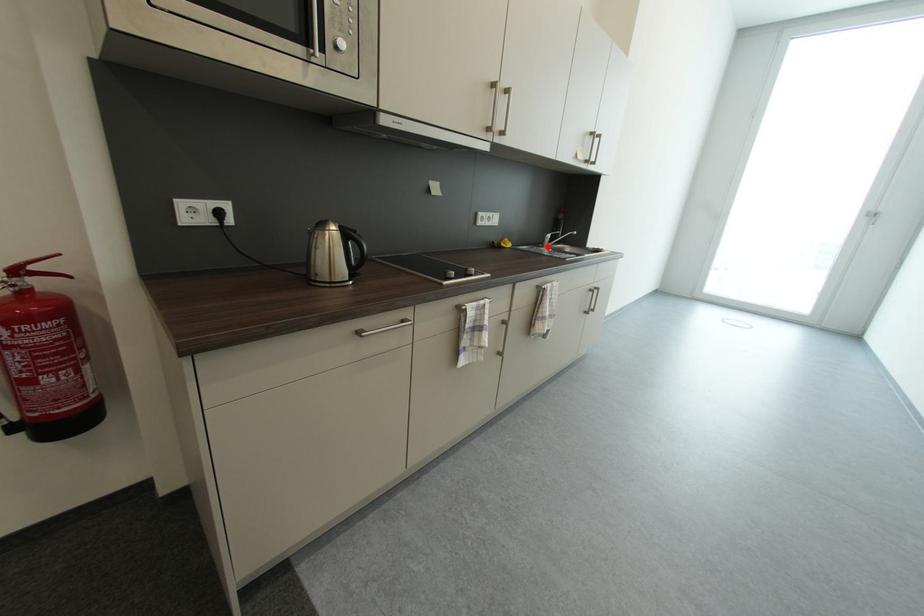
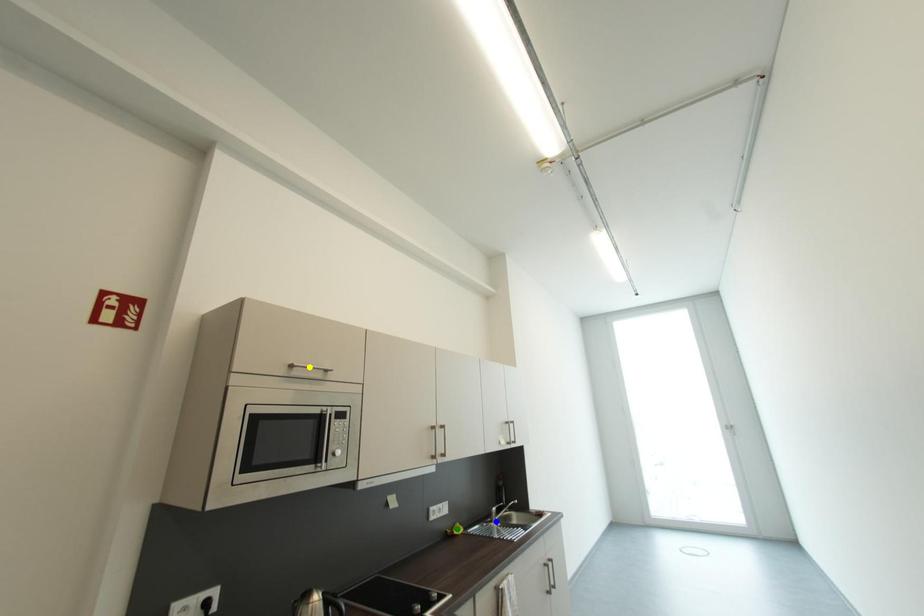
Question: I am providing you with two images of the same scene from different viewpoints. A red point is marked on the first image. You are given multiple points on the second image. Which point in image 2 represents the same 3d spot as the red point in image 1?

Choices:
 (A) blue point
 (B) yellow point
 (C) green point

Answer: (A)